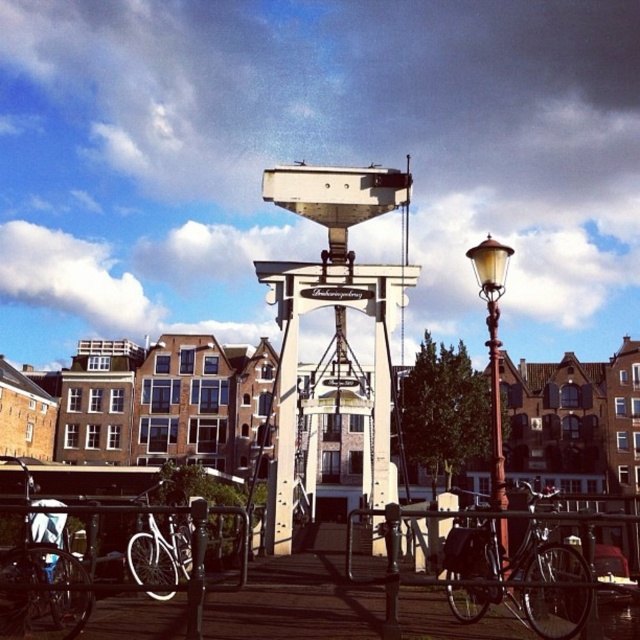
Question: Can you confirm if shiny silver bicycle at lower right is positioned below polished brass lamp post at right?

Choices:
 (A) no
 (B) yes

Answer: (B)

Question: Which point is farther from the camera taking this photo?

Choices:
 (A) (492, 388)
 (B) (488, 276)
 (C) (536, 532)

Answer: (B)

Question: Which point is closer to the camera taking this photo?

Choices:
 (A) (506, 560)
 (B) (561, 589)

Answer: (A)

Question: Can you confirm if silver metallic bicycle at lower left is positioned to the left of polished brass lamp post at right?

Choices:
 (A) yes
 (B) no

Answer: (A)

Question: Which point is closer to the camera?

Choices:
 (A) shiny silver bicycle at lower right
 (B) polished brass lamp post at right
 (C) white matte bicycle at lower left

Answer: (A)

Question: Can you confirm if shiny silver bicycle at lower right is wider than white matte bicycle at lower left?

Choices:
 (A) no
 (B) yes

Answer: (B)